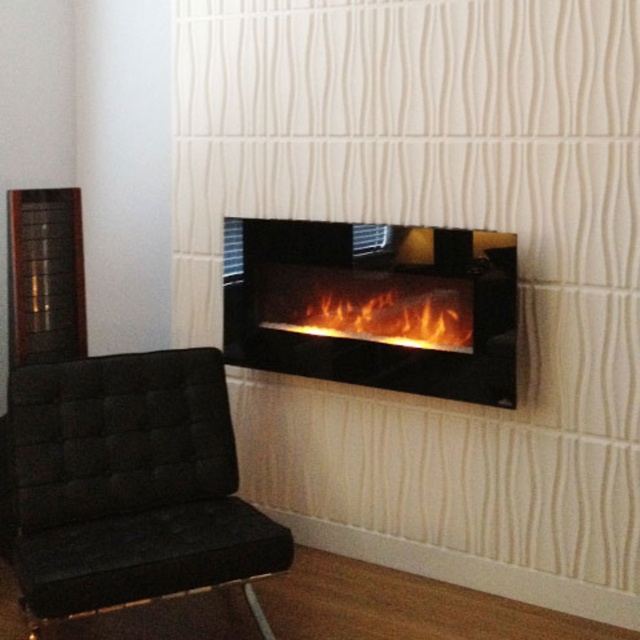
Is black fabric armchair at left further to the viewer compared to black glass fireplace at center?

No, black fabric armchair at left is closer to the viewer.

Where is `black fabric armchair at left`? The image size is (640, 640). black fabric armchair at left is located at coordinates (131, 484).

Does black glass fireplace at center appear on the right side of flametransparent glass/black frame at center?

In fact, black glass fireplace at center is to the left of flametransparent glass/black frame at center.

Is black glass fireplace at center above flametransparent glass/black frame at center?

Indeed, black glass fireplace at center is positioned over flametransparent glass/black frame at center.

Is point (291, 300) positioned before point (422, 296)?

No, it is not.

You are a GUI agent. You are given a task and a screenshot of the screen. Output one action in this format:
    pyautogui.click(x=<x>, y=<y>)
    Task: Click on the black glass fireplace at center
    
    Given the screenshot: What is the action you would take?
    pyautogui.click(x=372, y=305)

Is black fabric armchair at left thinner than flametransparent glass/black frame at center?

No.

Who is taller, black fabric armchair at left or flametransparent glass/black frame at center?

black fabric armchair at left

Describe the element at coordinates (131, 484) in the screenshot. I see `black fabric armchair at left` at that location.

At what (x,y) coordinates should I click in order to perform the action: click on black fabric armchair at left. Please return your answer as a coordinate pair (x, y). Looking at the image, I should click on (131, 484).